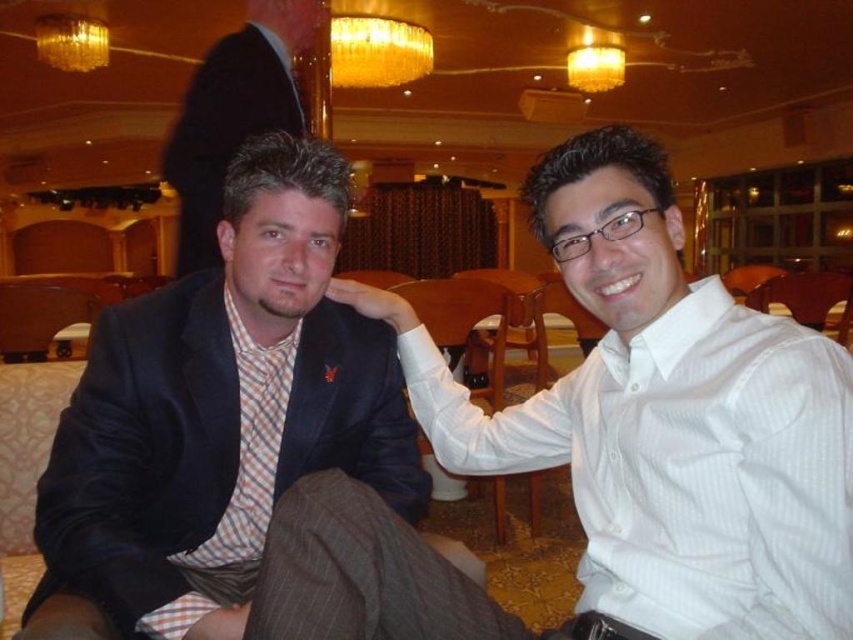
You are a photographer standing at the entrance of the room. You need to capture a photo of the matte black suit at center and the gold metallic chandelier at upper center in the same frame. The camera has a focal length of 50mm. Considering the distance between them, will the chandelier appear larger or smaller in the photo compared to its actual size?

The matte black suit at center is 1.73 meters from the gold metallic chandelier at upper center. Since the chandelier is closer to the camera than the suit, it will appear larger in the photo compared to its actual size.

You are a photographer setting up for an event. You need to position a spotlight above the matte black suit at center without casting shadows on the gold metallic chandelier at upper center. Is this possible based on the current setup?

The matte black suit at center is positioned under the gold metallic chandelier at upper center. Therefore, placing a spotlight directly above the matte black suit at center would cast a shadow on the gold metallic chandelier at upper center. To avoid this, the spotlight should be positioned to the side or angled in a way that the shadow falls elsewhere.